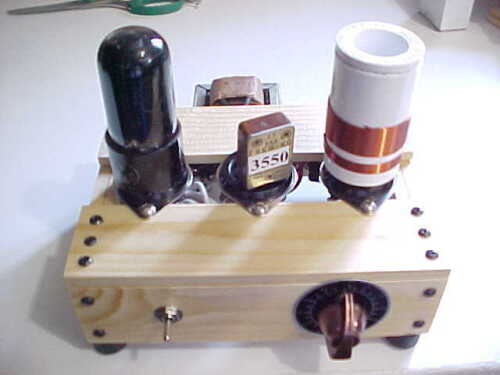
This screenshot has width=500, height=375. I want to click on top front of wooden box, so click(254, 242).